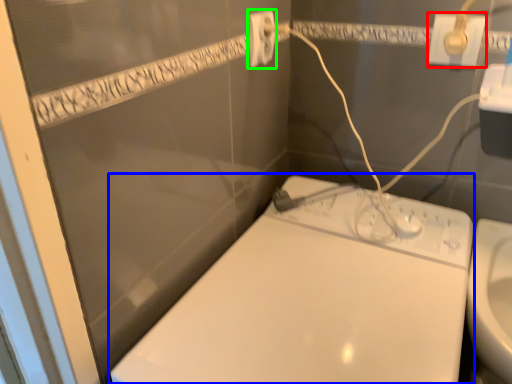
Question: Estimate the real-world distances between objects in this image. Which object is farther from power plugs and sockets (highlighted by a red box), toilet (highlighted by a blue box) or power plugs and sockets (highlighted by a green box)?

Choices:
 (A) toilet
 (B) power plugs and sockets

Answer: (A)